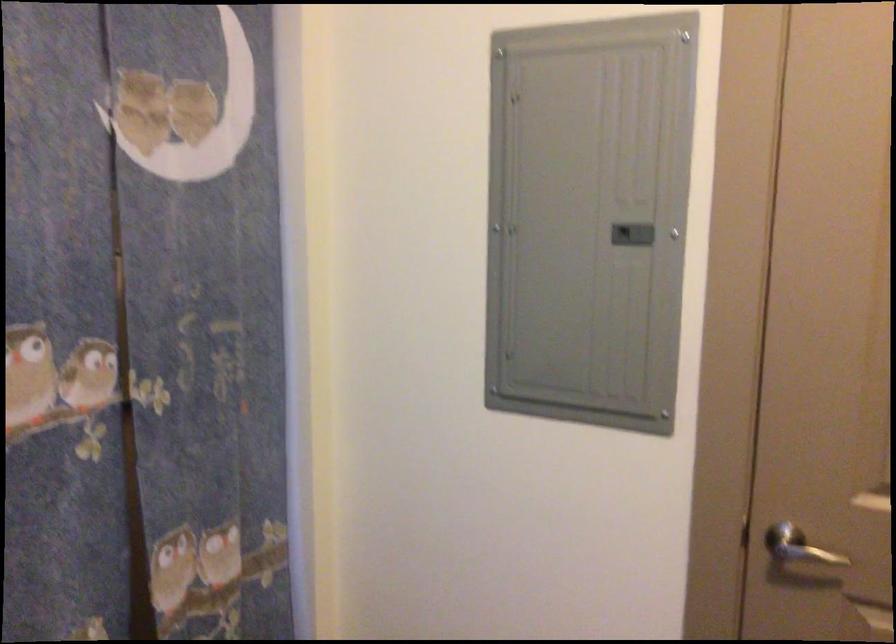
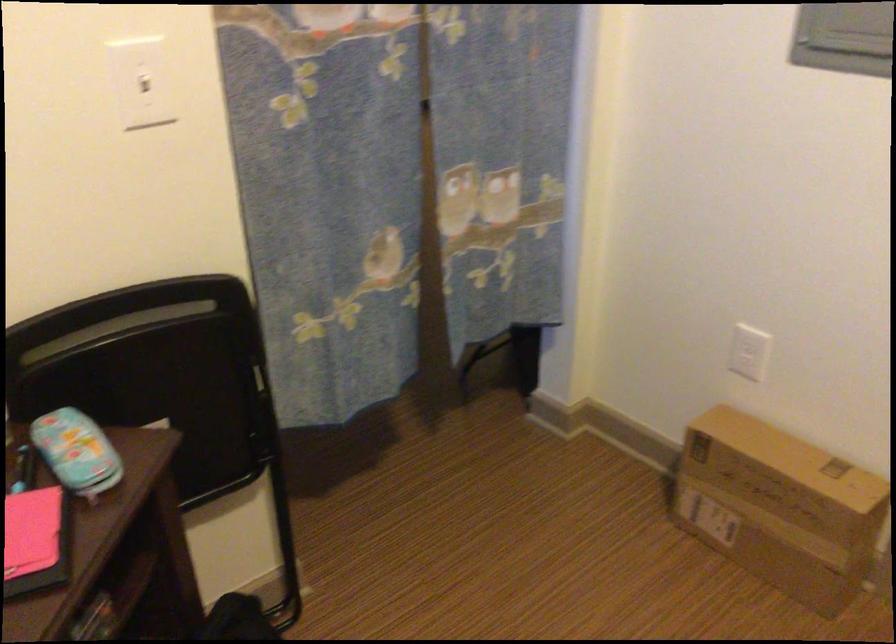
Question: In a continuous first-person perspective shot, in which direction is the camera moving?

Choices:
 (A) Left
 (B) Right
 (C) Forward
 (D) Backward

Answer: (D)